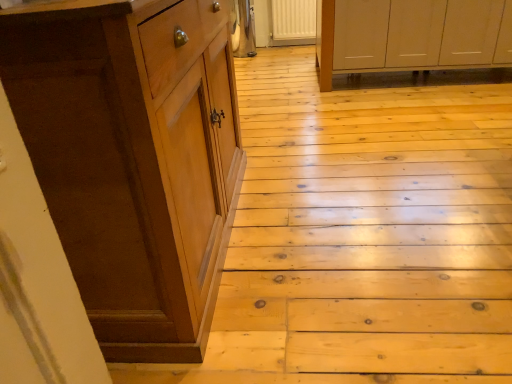
Locate an element on the screen. vacant area that is in front of white matte cabinet at upper right, arranged as the 2th cabinetry when viewed from the front is located at coordinates (421, 125).